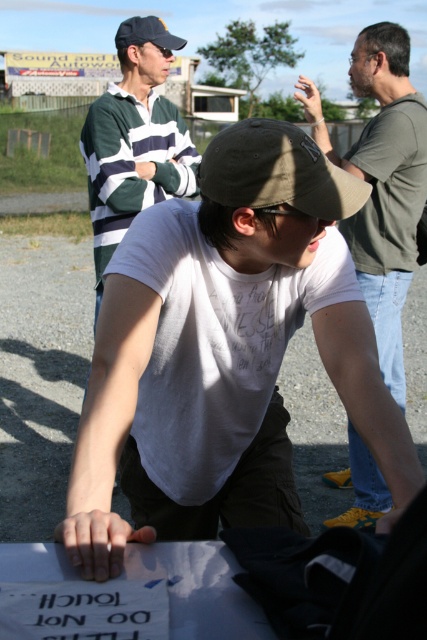
Can you confirm if white matte t-shirt at center is thinner than khaki fabric baseball cap at center?

In fact, white matte t-shirt at center might be wider than khaki fabric baseball cap at center.

Does white matte t-shirt at center appear on the left side of khaki fabric baseball cap at center?

Yes, white matte t-shirt at center is to the left of khaki fabric baseball cap at center.

I want to click on white matte t-shirt at center, so click(225, 352).

Which is behind, point (359, 240) or point (240, 179)?

Point (359, 240)

Does matte green shirt at upper right have a greater height compared to khaki fabric baseball cap at center?

Correct, matte green shirt at upper right is much taller as khaki fabric baseball cap at center.

Is point (383, 506) behind point (269, 193)?

Yes, it is behind point (269, 193).

This screenshot has height=640, width=427. I want to click on matte green shirt at upper right, so click(382, 182).

Which is above, white matte t-shirt at center or matte green shirt at upper right?

matte green shirt at upper right

Is point (265, 144) more distant than point (388, 314)?

No, it is in front of (388, 314).

Where is `white matte t-shirt at center`? This screenshot has height=640, width=427. white matte t-shirt at center is located at coordinates (225, 352).